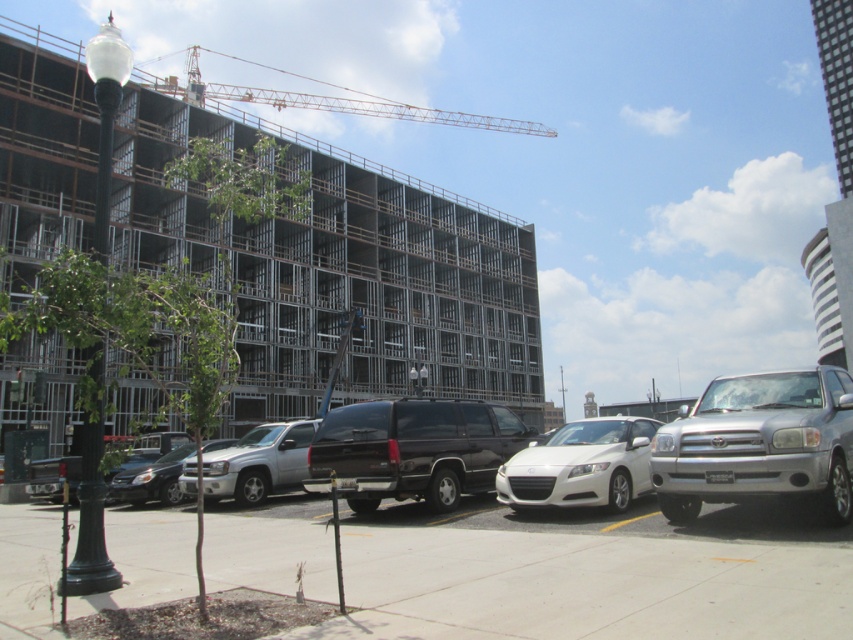
Question: Does metal frame building at upper left appear over shiny black suv at center?

Choices:
 (A) no
 (B) yes

Answer: (B)

Question: In this image, where is smooth concrete pavement at center located relative to silver metallic suv at center?

Choices:
 (A) left
 (B) right

Answer: (B)

Question: Which point is closer to the camera?

Choices:
 (A) (250, 502)
 (B) (500, 416)

Answer: (B)

Question: From the image, what is the correct spatial relationship of shiny black suv at center in relation to silver metallic suv at center?

Choices:
 (A) left
 (B) right

Answer: (B)

Question: Which point appears farthest from the camera in this image?

Choices:
 (A) (218, 442)
 (B) (793, 616)
 (C) (643, 419)
 (D) (276, 97)

Answer: (D)

Question: Which of the following is the closest to the observer?

Choices:
 (A) silver metallic suv at center
 (B) silver metallic suv at right

Answer: (B)